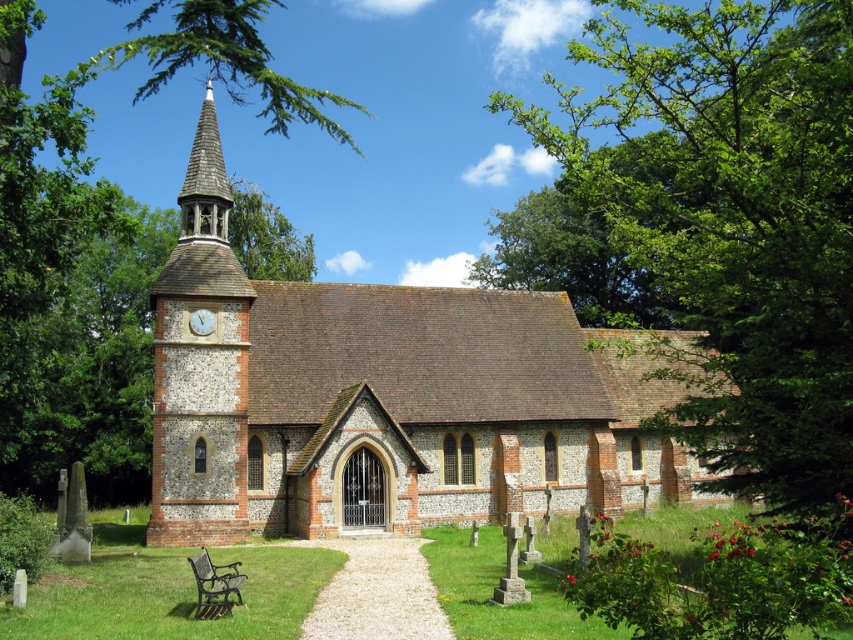
You are standing in front of the church and want to take a photo that includes both the brick church at center and the wooden shingles spire at upper center. Which object should you focus on first to ensure both are in frame?

The brick church at center is much taller than the wooden shingles spire at upper center, so you should focus on the brick church at center first to ensure both are in frame.

You are standing in front of the church and notice two points marked in the image. The first point is at coordinates point (448, 433) and the second point is at point (223, 388). Which of these points is closer to you?

Point (223, 388) is closer to you because it is less further to the camera than point (448, 433).

You are standing at the point marked by coordinates point (389, 406). Based on the scene, what is the most likely landmark you are currently positioned at?

The point (389, 406) represents the brick church at center, so you are positioned at the brick church at center.